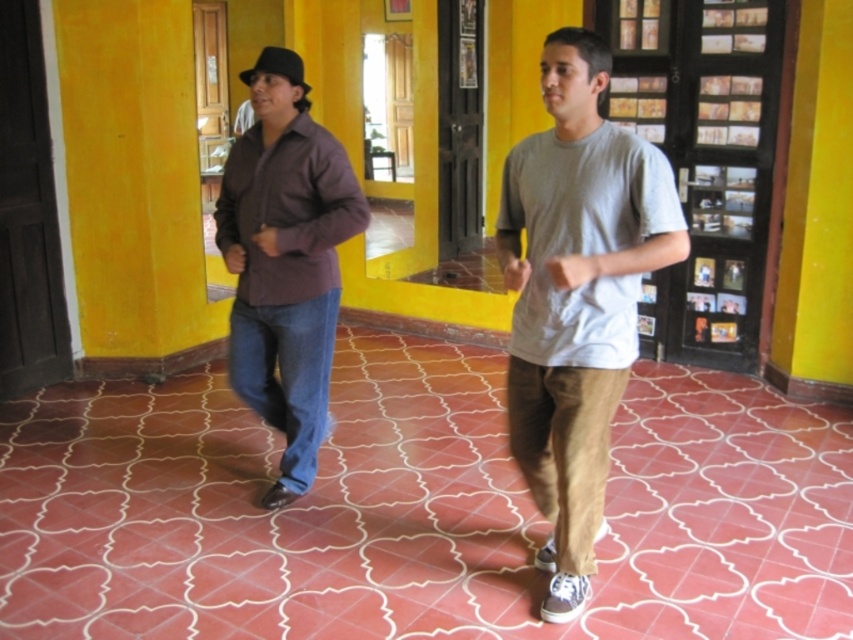
Which is more to the right, gray cotton t-shirt at center or matte black baseball hat at left?

gray cotton t-shirt at center

Describe the element at coordinates (576, 296) in the screenshot. The width and height of the screenshot is (853, 640). I see `gray cotton t-shirt at center` at that location.

This screenshot has height=640, width=853. What do you see at coordinates (576, 296) in the screenshot?
I see `gray cotton t-shirt at center` at bounding box center [576, 296].

Identify the location of gray cotton t-shirt at center. (576, 296).

Does matte brown shirt at left appear on the left side of matte black baseball hat at left?

Correct, you'll find matte brown shirt at left to the left of matte black baseball hat at left.

Is point (245, 298) farther from camera compared to point (260, 64)?

Yes, it is.

Is point (271, 508) in front of point (244, 81)?

No, it is behind (244, 81).

Find the location of a particular element. matte brown shirt at left is located at coordinates (285, 260).

At what (x,y) coordinates should I click in order to perform the action: click on gray cotton t-shirt at center. Please return your answer as a coordinate pair (x, y). The height and width of the screenshot is (640, 853). Looking at the image, I should click on (576, 296).

Can you confirm if gray cotton t-shirt at center is wider than matte brown shirt at left?

No.

This screenshot has height=640, width=853. What do you see at coordinates (576, 296) in the screenshot?
I see `gray cotton t-shirt at center` at bounding box center [576, 296].

You are a GUI agent. You are given a task and a screenshot of the screen. Output one action in this format:
    pyautogui.click(x=<x>, y=<y>)
    Task: Click on the gray cotton t-shirt at center
    This screenshot has width=853, height=640.
    Given the screenshot: What is the action you would take?
    pyautogui.click(x=576, y=296)